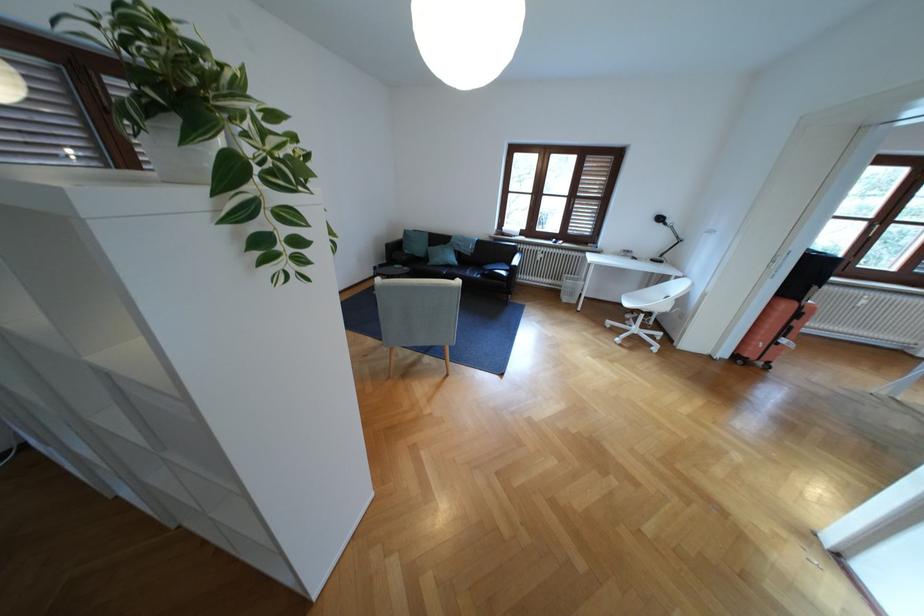
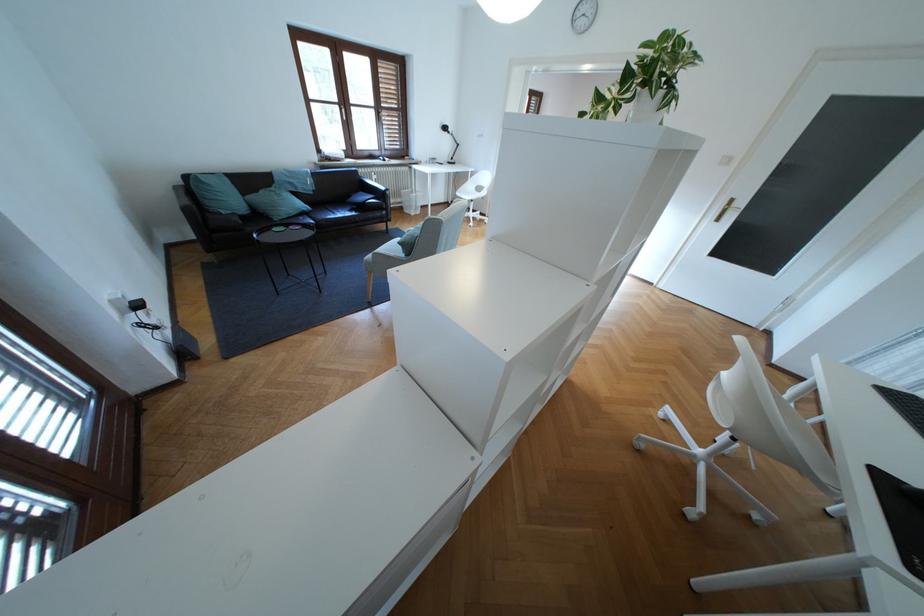
In the second image, find the point that corresponds to the point at 417,252 in the first image.

(234, 213)